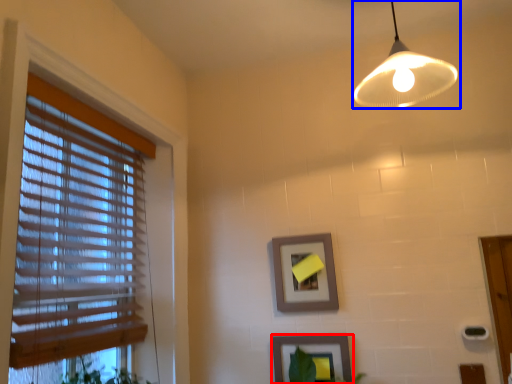
Question: Which of the following is the closest to the observer, picture frame (highlighted by a red box) or lamp (highlighted by a blue box)?

Choices:
 (A) picture frame
 (B) lamp

Answer: (B)